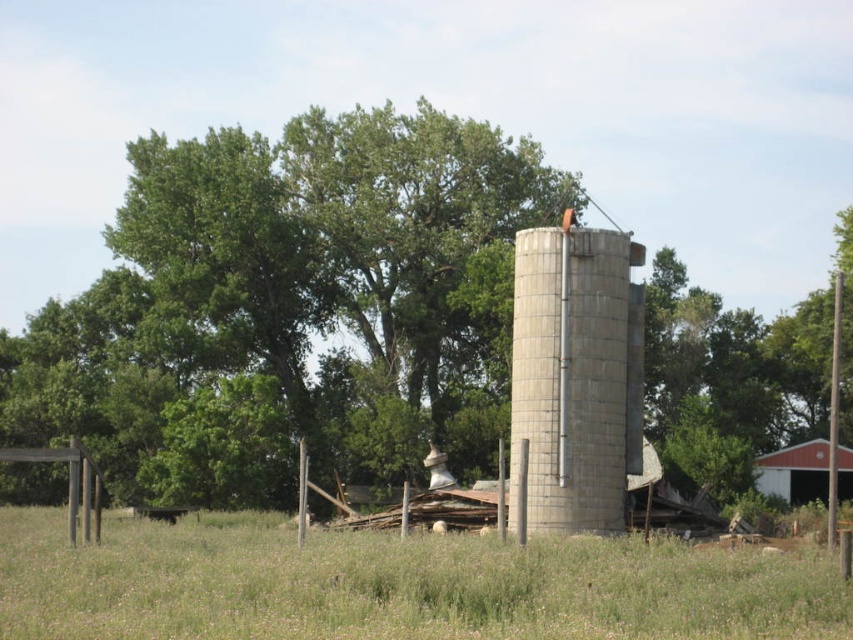
You are standing in the middle of the field looking towards the silo. You want to walk to the red wood barn at lower right. Which direction should you move relative to the green grass at center?

You should move to the right relative to the green grass at center because the red wood barn at lower right is located to the right of the green grass at center.

You are a farmer planning to install a new wind turbine. You want to place it in the field between the gray concrete silo at center and the red wood barn at lower right. Considering their sizes, which structure will the turbine be closer to after installation?

The gray concrete silo at center has a larger size compared to red wood barn at lower right. Since the silo is bigger, the turbine will be closer to the smaller red wood barn at lower right to maintain balance between the two structures.